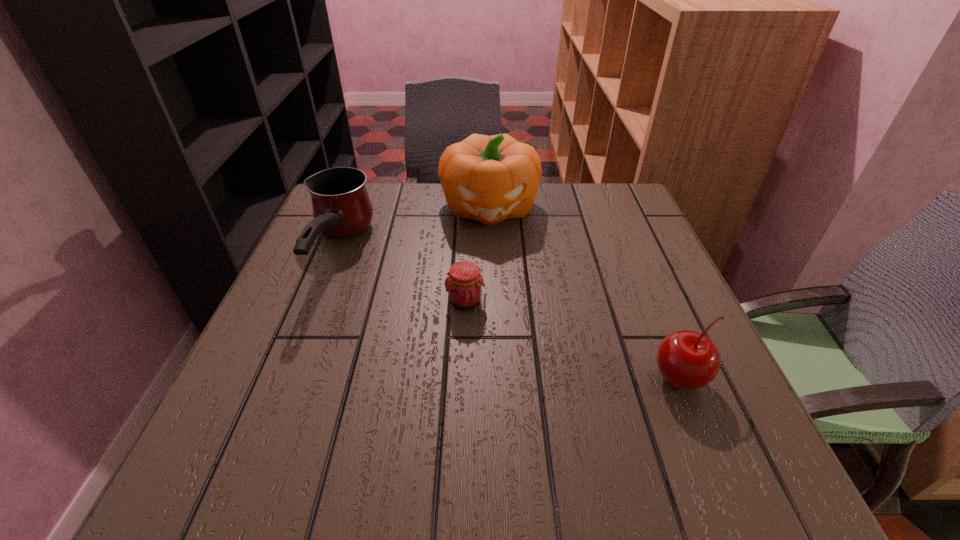
Locate which object ranks second in proximity to the third tallest object. Please provide its 2D coordinates. Your answer should be formatted as a tuple, i.e. [(x, y)], where the tuple contains the x and y coordinates of a point satisfying the conditions above.

[(490, 179)]

Identify which object is the third nearest to the shortest object. Please provide its 2D coordinates. Your answer should be formatted as a tuple, i.e. [(x, y)], where the tuple contains the x and y coordinates of a point satisfying the conditions above.

[(688, 360)]

Find the location of a particular element. free space in the image that satisfies the following two spatial constraints: 1. on the handle side of the leftmost object; 2. on the right side of the rightmost object is located at coordinates [x=285, y=379].

Where is `vacant area in the image that satisfies the following two spatial constraints: 1. on the handle side of the shortest object; 2. on the right side of the saucepan`? vacant area in the image that satisfies the following two spatial constraints: 1. on the handle side of the shortest object; 2. on the right side of the saucepan is located at coordinates (316, 301).

Locate an element on the screen. The width and height of the screenshot is (960, 540). vacant space that satisfies the following two spatial constraints: 1. on the handle side of the third shortest object; 2. on the right side of the nearest object is located at coordinates (285, 379).

Where is `free spot that satisfies the following two spatial constraints: 1. on the handle side of the nearest object; 2. on the left side of the leftmost object`? free spot that satisfies the following two spatial constraints: 1. on the handle side of the nearest object; 2. on the left side of the leftmost object is located at coordinates (285, 379).

You are a GUI agent. You are given a task and a screenshot of the screen. Output one action in this format:
    pyautogui.click(x=<x>, y=<y>)
    Task: Click on the free space that satisfies the following two spatial constraints: 1. on the handle side of the jam; 2. on the left side of the saucepan
    
    Given the screenshot: What is the action you would take?
    pyautogui.click(x=316, y=301)

You are a GUI agent. You are given a task and a screenshot of the screen. Output one action in this format:
    pyautogui.click(x=<x>, y=<y>)
    Task: Click on the vacant space that satisfies the following two spatial constraints: 1. on the handle side of the nearest object; 2. on the left side of the leftmost object
    The height and width of the screenshot is (540, 960).
    Given the screenshot: What is the action you would take?
    (285, 379)